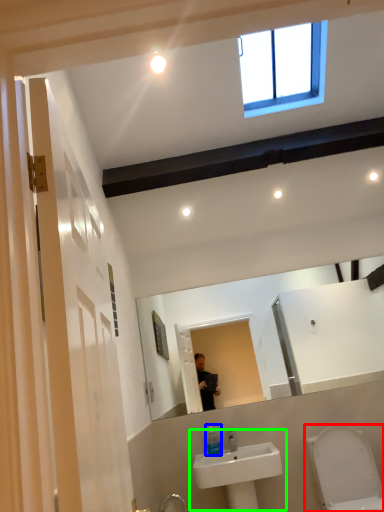
Question: Considering the real-world distances, which object is closest to toilet (highlighted by a red box)? soap dispenser (highlighted by a blue box) or sink (highlighted by a green box).

Choices:
 (A) soap dispenser
 (B) sink

Answer: (B)